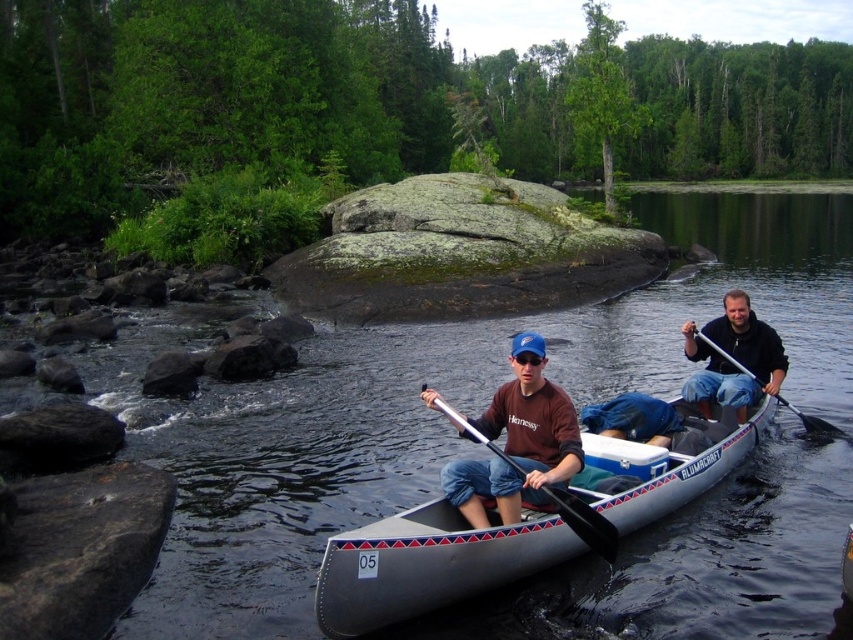
Question: Is dark blue jeans at center to the left of silver metallic paddle at center from the viewer's perspective?

Choices:
 (A) yes
 (B) no

Answer: (B)

Question: Which object is the closest to the silver metallic paddle at center?

Choices:
 (A) clear water at center
 (B) black plastic paddle at right
 (C) matte brown shirt at center
 (D) dark blue jeans at center

Answer: (C)

Question: Is dark blue jeans at center closer to the viewer compared to silver metallic paddle at center?

Choices:
 (A) no
 (B) yes

Answer: (A)

Question: Is gray rubber canoe at center wider than matte brown shirt at center?

Choices:
 (A) no
 (B) yes

Answer: (B)

Question: Which object is positioned closest to the black plastic paddle at right?

Choices:
 (A) silver metallic paddle at center
 (B) gray rubber canoe at center

Answer: (B)

Question: Among these points, which one is nearest to the camera?

Choices:
 (A) (746, 323)
 (B) (738, 298)
 (C) (802, 416)

Answer: (B)